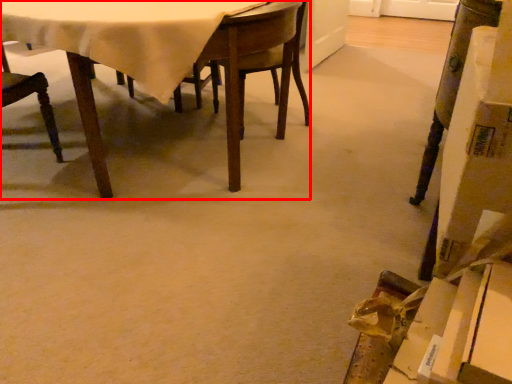
Question: In this image, where is table (annotated by the red box) located relative to chair?

Choices:
 (A) left
 (B) right

Answer: (B)